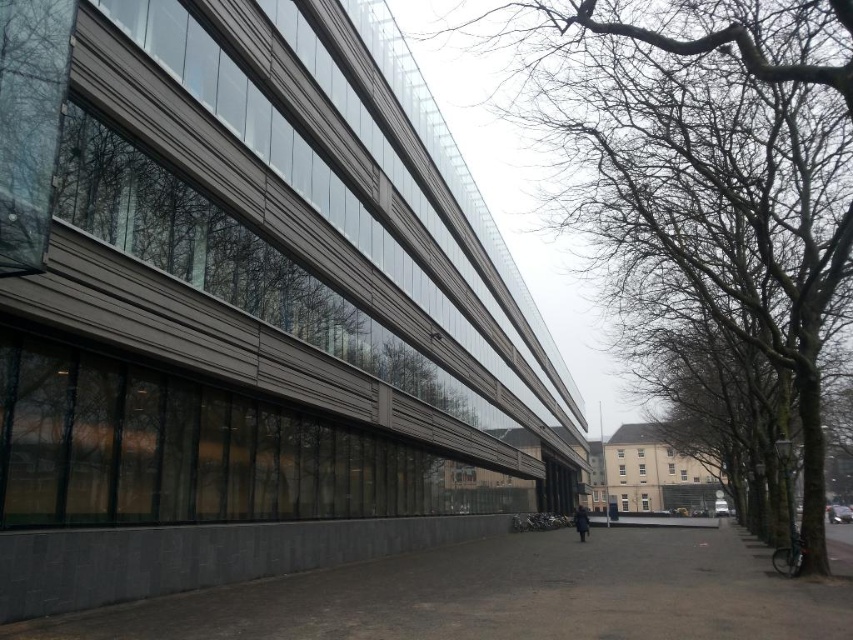
Question: Where is bare branches at upper right located in relation to dark gray coat at center in the image?

Choices:
 (A) below
 (B) above

Answer: (B)

Question: Considering the relative positions of bare branches at upper right and dark gray coat at center in the image provided, where is bare branches at upper right located with respect to dark gray coat at center?

Choices:
 (A) right
 (B) left

Answer: (B)

Question: Which point appears farthest from the camera in this image?

Choices:
 (A) (772, 6)
 (B) (589, 525)

Answer: (B)

Question: Can you confirm if bare branches at upper right is positioned to the right of dark gray coat at center?

Choices:
 (A) no
 (B) yes

Answer: (A)